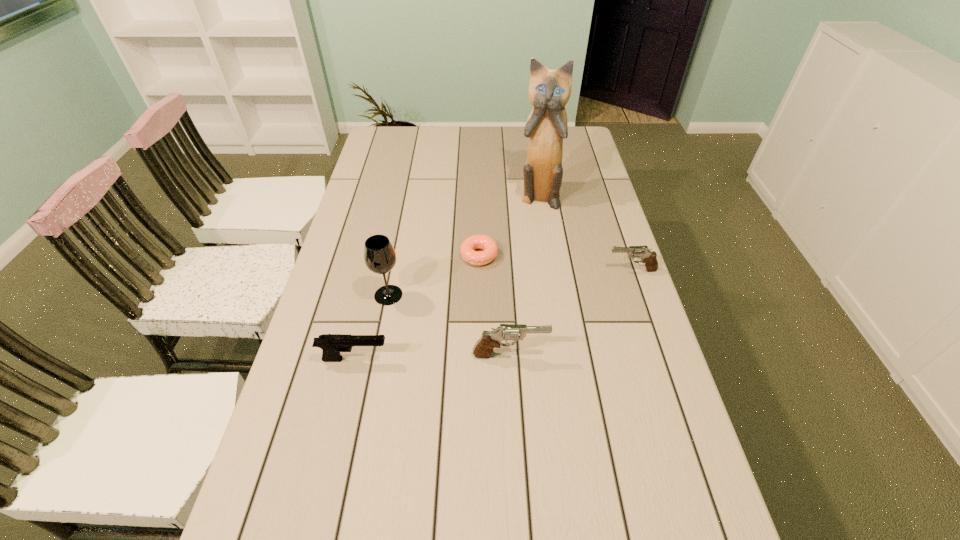
The image size is (960, 540). I want to click on the second pistol from left to right, so click(489, 340).

Image resolution: width=960 pixels, height=540 pixels. Find the location of `the fourth shortest object`. the fourth shortest object is located at coordinates (489, 340).

Locate an element on the screen. This screenshot has height=540, width=960. the rightmost object is located at coordinates (648, 257).

The image size is (960, 540). In order to click on the rightmost pistol in this screenshot , I will do `click(648, 257)`.

Locate an element on the screen. Image resolution: width=960 pixels, height=540 pixels. cat is located at coordinates (549, 90).

I want to click on the farthest object, so click(549, 90).

In order to click on wineglass in this screenshot , I will do `click(379, 255)`.

This screenshot has width=960, height=540. I want to click on the third nearest object, so 379,255.

Locate an element on the screen. doughnut is located at coordinates (483, 242).

Locate an element on the screen. The width and height of the screenshot is (960, 540). the leftmost pistol is located at coordinates (332, 344).